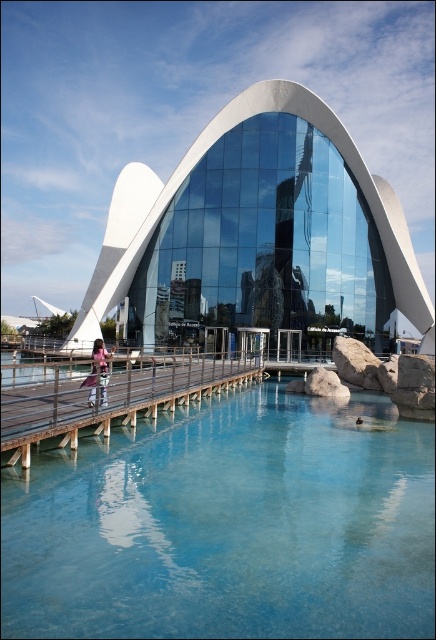
Question: Is white glass building at center bigger than wooden dock at lower center?

Choices:
 (A) no
 (B) yes

Answer: (B)

Question: Which object appears closest to the camera in this image?

Choices:
 (A) pink fabric at left
 (B) white glass building at center
 (C) transparent glass water at center
 (D) wooden dock at lower center

Answer: (C)

Question: Is transparent glass water at center smaller than wooden dock at lower center?

Choices:
 (A) yes
 (B) no

Answer: (A)

Question: Which is farther from the white glass building at center?

Choices:
 (A) wooden dock at lower center
 (B) pink fabric at left

Answer: (B)

Question: Which object is closer to the camera taking this photo?

Choices:
 (A) white glass building at center
 (B) wooden dock at lower center
 (C) pink fabric at left

Answer: (B)

Question: Is white glass building at center positioned before wooden dock at lower center?

Choices:
 (A) yes
 (B) no

Answer: (B)